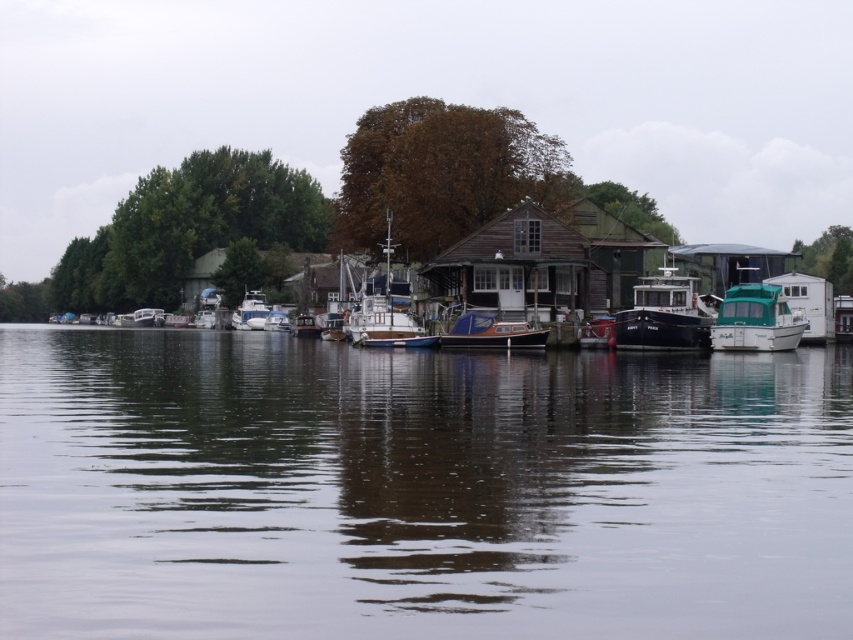
Which is above, teal glossy houseboat at right or white matte boat at left?

white matte boat at left is above.

Can you confirm if teal glossy houseboat at right is positioned below white matte boat at left?

Correct, teal glossy houseboat at right is located below white matte boat at left.

At what (x,y) coordinates should I click in order to perform the action: click on teal glossy houseboat at right. Please return your answer as a coordinate pair (x, y). The image size is (853, 640). Looking at the image, I should click on (755, 321).

Is transparent water at center shorter than white wooden boat at center?

Yes.

Does transparent water at center appear under white wooden boat at center?

Indeed, transparent water at center is positioned under white wooden boat at center.

At what (x,y) coordinates should I click in order to perform the action: click on transparent water at center. Please return your answer as a coordinate pair (x, y). This screenshot has width=853, height=640. Looking at the image, I should click on (416, 490).

From the picture: Who is shorter, matte black boat at center or teal glossy houseboat at right?

teal glossy houseboat at right

Does point (706, 317) come behind point (793, 323)?

Yes.

Locate an element on the screen. This screenshot has width=853, height=640. matte black boat at center is located at coordinates (665, 314).